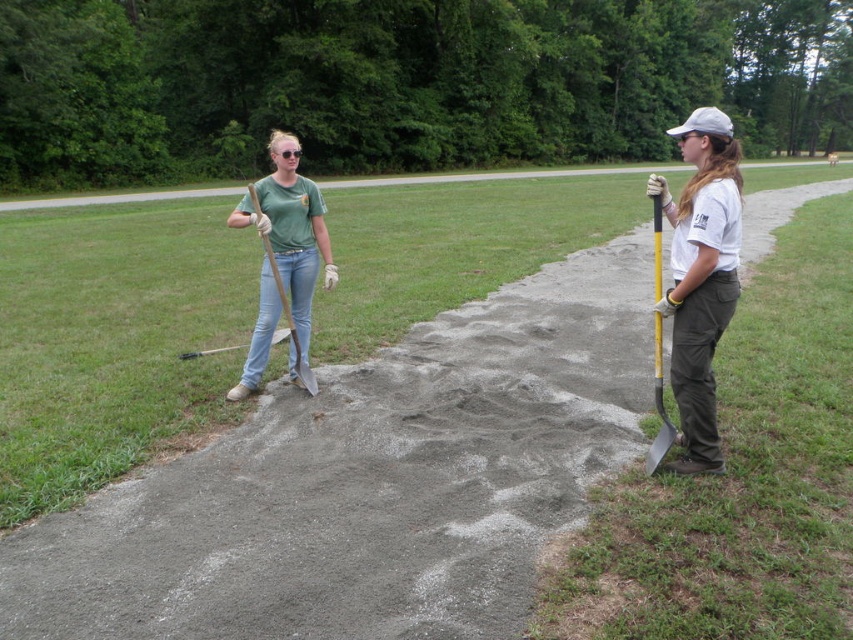
Which is more to the right, gray concrete path at center or white fabric baseball cap at upper right?

From the viewer's perspective, white fabric baseball cap at upper right appears more on the right side.

What do you see at coordinates (497, 177) in the screenshot?
I see `gray concrete path at center` at bounding box center [497, 177].

Who is more forward, (36,204) or (724,124)?

Positioned in front is point (724,124).

You are a GUI agent. You are given a task and a screenshot of the screen. Output one action in this format:
    pyautogui.click(x=<x>, y=<y>)
    Task: Click on the gray concrete path at center
    
    Given the screenshot: What is the action you would take?
    pyautogui.click(x=497, y=177)

Between yellow plastic shovel at right and white fabric baseball cap at upper right, which one has more height?

white fabric baseball cap at upper right

Is point (659, 460) less distant than point (695, 116)?

No, it is not.

At what (x,y) coordinates should I click in order to perform the action: click on yellow plastic shovel at right. Please return your answer as a coordinate pair (x, y). Looking at the image, I should click on (659, 406).

Describe the element at coordinates (497, 177) in the screenshot. I see `gray concrete path at center` at that location.

The image size is (853, 640). Find the location of `gray concrete path at center`. gray concrete path at center is located at coordinates (497, 177).